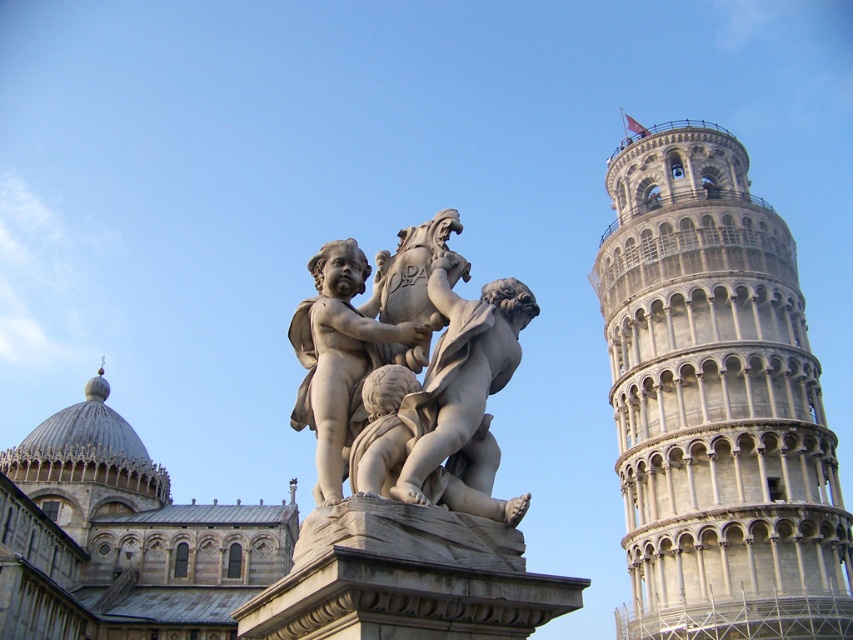
Question: Where is gray stone tower at right located in relation to white marble statue at center in the image?

Choices:
 (A) below
 (B) above

Answer: (B)

Question: Is gray stone tower at right further to the viewer compared to white marble statue at center?

Choices:
 (A) no
 (B) yes

Answer: (B)

Question: Which point is closer to the camera taking this photo?

Choices:
 (A) (730, 502)
 (B) (434, 353)
 (C) (294, 316)

Answer: (B)

Question: Does gray stone tower at right have a lesser width compared to polished stone statue at center?

Choices:
 (A) no
 (B) yes

Answer: (A)

Question: Based on their relative distances, which object is farther from the polished stone statue at center?

Choices:
 (A) gray stone tower at right
 (B) white marble statue at center

Answer: (A)

Question: Which point appears closest to the camera in this image?

Choices:
 (A) (782, 416)
 (B) (341, 460)
 (C) (448, 294)

Answer: (B)